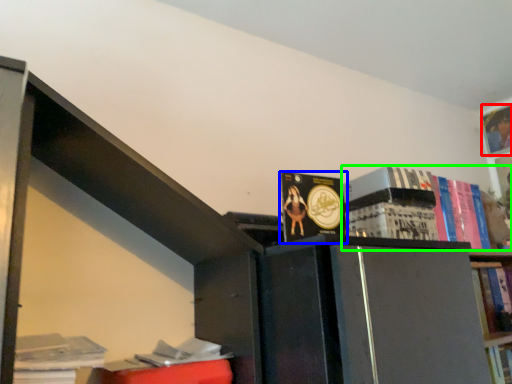
Question: Estimate the real-world distances between objects in this image. Which object is farther from book (highlighted by a red box), book (highlighted by a blue box) or book (highlighted by a green box)?

Choices:
 (A) book
 (B) book

Answer: (A)